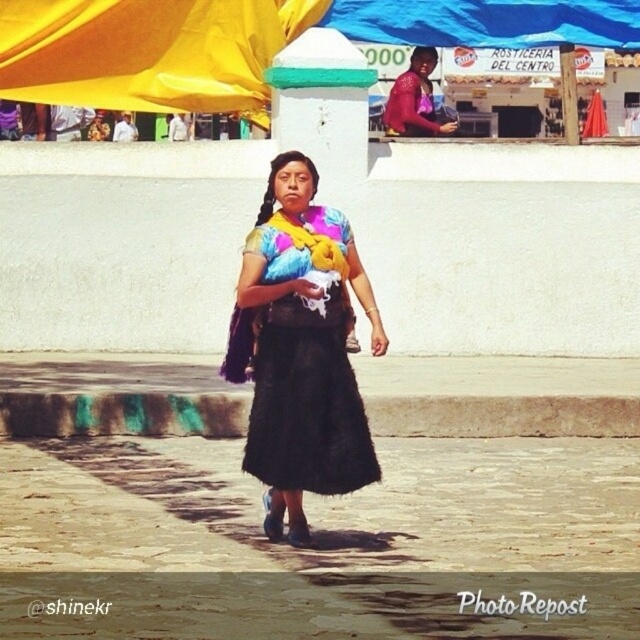
From the picture: You are a street vendor who wants to choose between the yellow fabric canopy at upper left and the blue tarpaulin at upper center to cover your stall. Which one is thinner and thus easier to fold and store?

The yellow fabric canopy at upper left is thinner than the blue tarpaulin at upper center, so it would be easier to fold and store.

How far apart are the woman and the yellow fabric canopy at upper left?

The woman and the yellow fabric canopy at upper left are 16.23 meters apart.

Based on the photo, you are a photographer standing at the edge of the street. You want to capture a photo that includes both the black fuzzy skirt at center and the matte red blouse at upper center. What is the minimum distance you need to move backward to ensure both objects are in frame?

The black fuzzy skirt at center is 7.97 meters from the matte red blouse at upper center. To include both in the frame, you need to move back at least 7.97 meters so the camera can capture the full distance between them.